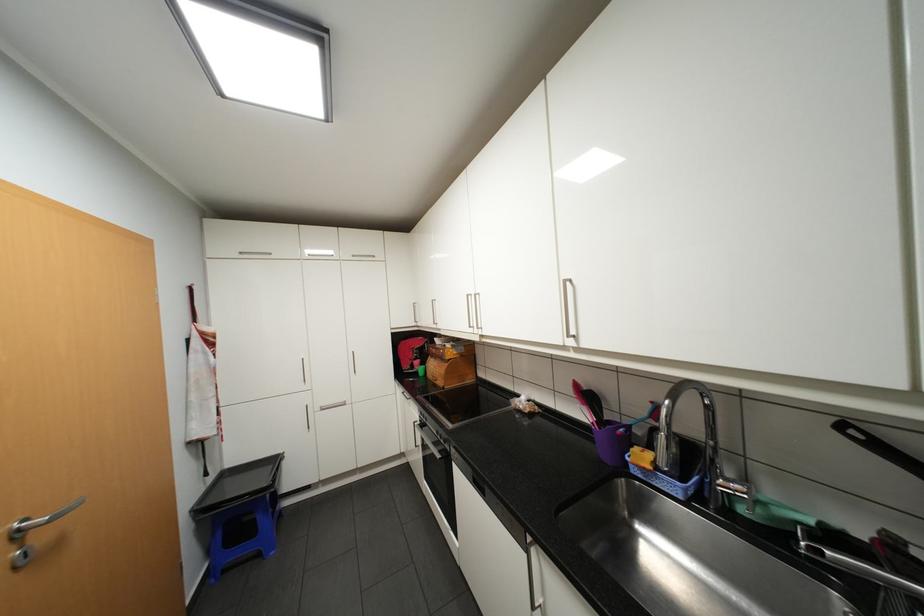
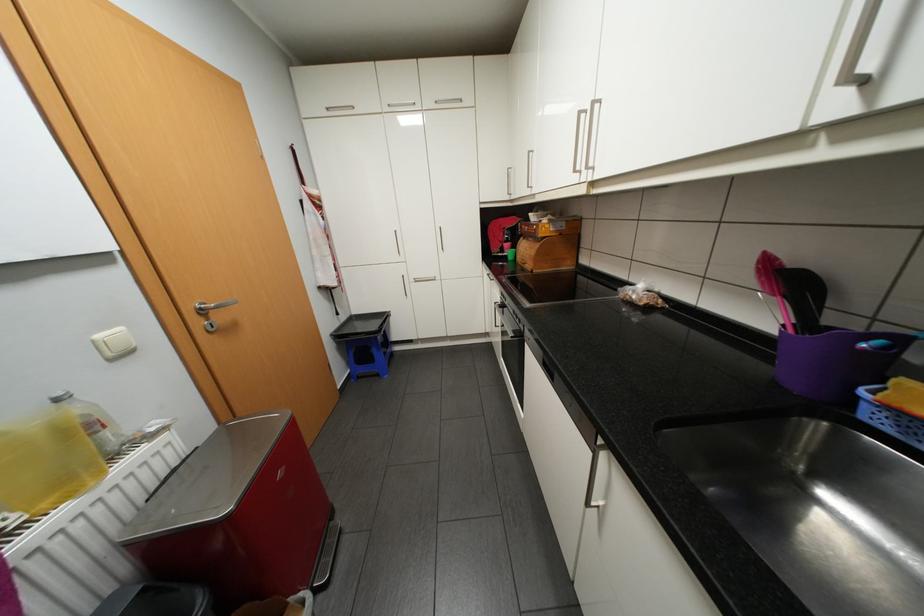
The point at (597, 397) is marked in the first image. Where is the corresponding point in the second image?

(800, 283)